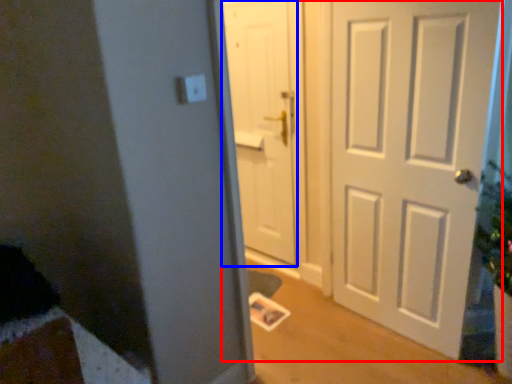
Question: Among these objects, which one is farthest to the camera, door (highlighted by a red box) or door (highlighted by a blue box)?

Choices:
 (A) door
 (B) door

Answer: (B)